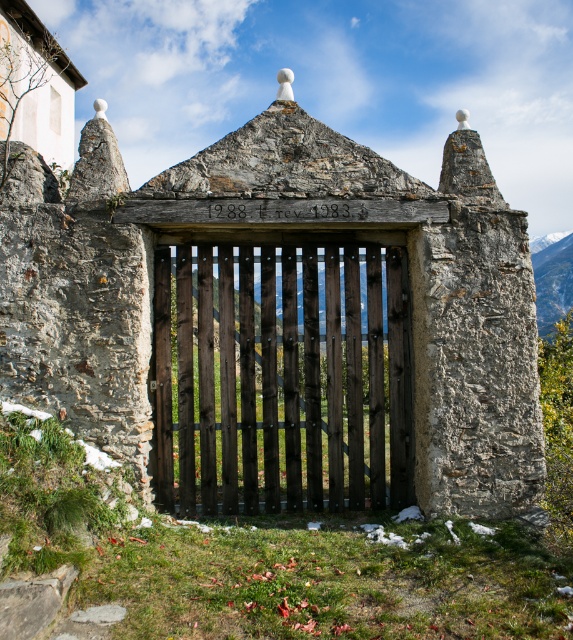
Question: Considering the relative positions of dark wood gate at center and smooth gray rock at upper right in the image provided, where is dark wood gate at center located with respect to smooth gray rock at upper right?

Choices:
 (A) above
 (B) below

Answer: (B)

Question: Which object is closer to the camera taking this photo?

Choices:
 (A) dark wood gate at center
 (B) smooth gray rock at upper right

Answer: (B)

Question: Is dark wood gate at center thinner than smooth gray rock at upper right?

Choices:
 (A) no
 (B) yes

Answer: (B)

Question: Is dark wood gate at center smaller than smooth gray rock at upper right?

Choices:
 (A) yes
 (B) no

Answer: (A)

Question: Which of the following is the farthest from the observer?

Choices:
 (A) (380, 445)
 (B) (550, 260)

Answer: (B)